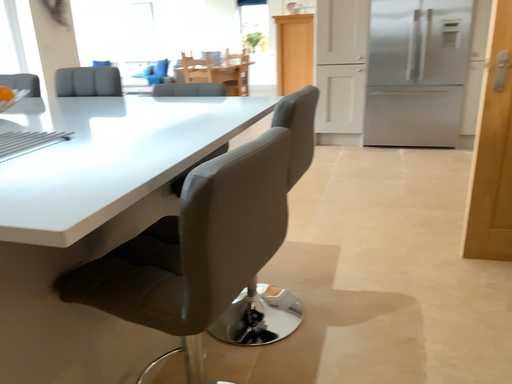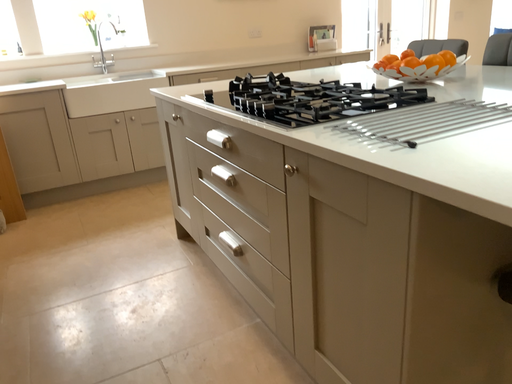
Question: Which way did the camera rotate in the video?

Choices:
 (A) rotated right
 (B) rotated left

Answer: (B)